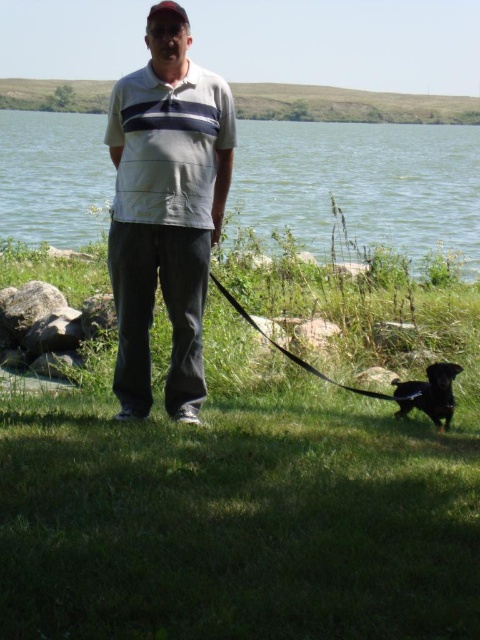
Question: Can you confirm if green grass at lower center is positioned above white striped shirt at center?

Choices:
 (A) yes
 (B) no

Answer: (B)

Question: Is clear water at center above white striped shirt at center?

Choices:
 (A) yes
 (B) no

Answer: (A)

Question: Which point appears closest to the camera in this image?

Choices:
 (A) (253, 580)
 (B) (296, 148)
 (C) (119, 337)

Answer: (A)

Question: Among these points, which one is farthest from the camera?

Choices:
 (A) (177, 288)
 (B) (96, 579)

Answer: (A)

Question: Is green grass at lower center to the right of shiny black dog at lower right from the viewer's perspective?

Choices:
 (A) no
 (B) yes

Answer: (A)

Question: Which point is farther to the camera?

Choices:
 (A) clear water at center
 (B) white striped shirt at center
 (C) green grass at lower center

Answer: (A)